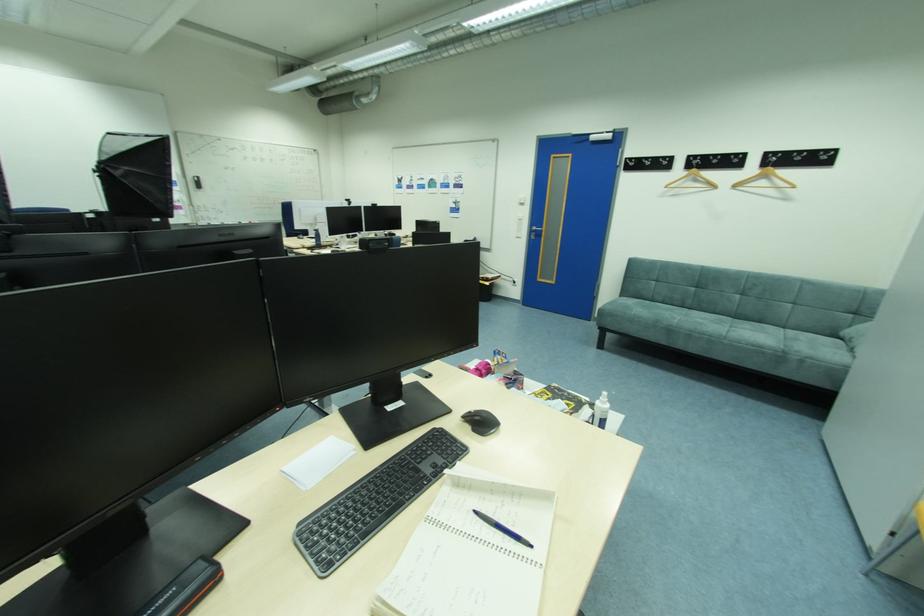
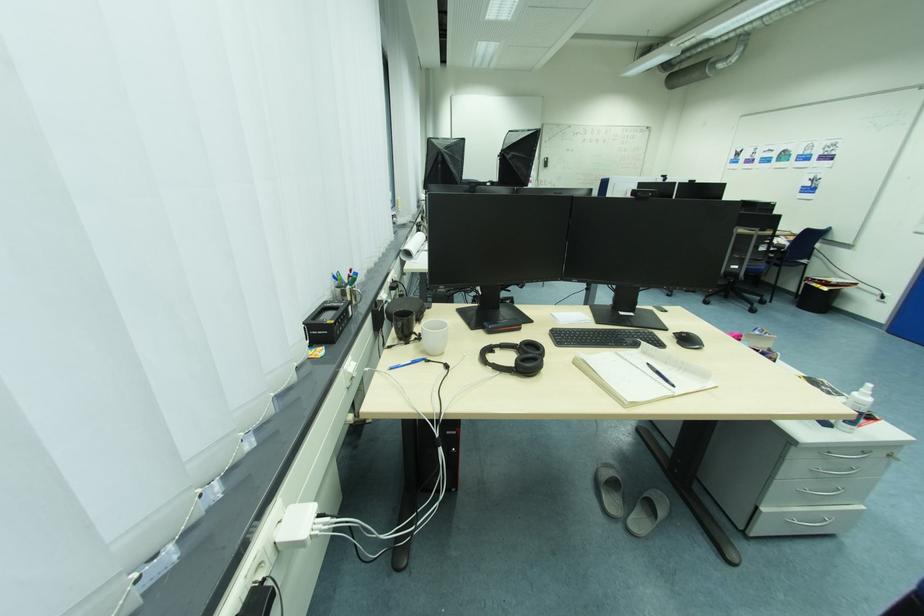
Locate, in the second image, the point that corresponds to (x=537, y=546) in the first image.

(681, 387)